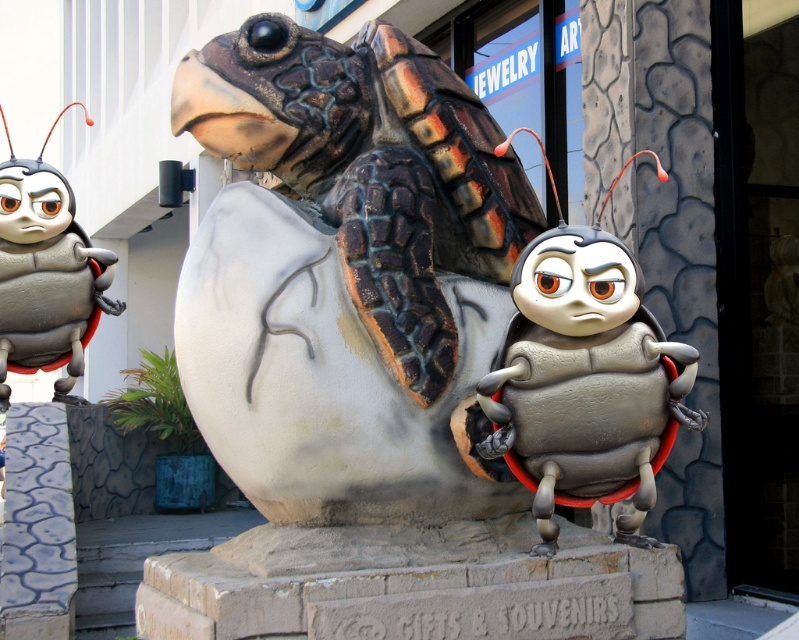
You are a photographer trying to capture the scene with a camera that has a limited depth of field. You want to focus on the point at point (243,54) and point (44,216). Since your camera can only focus on one point at a time, which point should you choose to ensure both points are in focus?

You should focus on point (243,54) because it is closer to the camera than point (44,216), so focusing on it will keep both points in focus.

You are an observer looking at the scene. There is a matte painted tortoise at center and a metallic gray beetle at center. Which one is placed higher in the image?

The matte painted tortoise at center is positioned over the metallic gray beetle at center, so it is higher.

You are an artist who wants to draw the scene with the matte painted tortoise at center and the metallic gray beetle at center. Which of the two insects is on the right side of the tortoise?

→ The metallic gray beetle at center is on the right side of the matte painted tortoise at center.